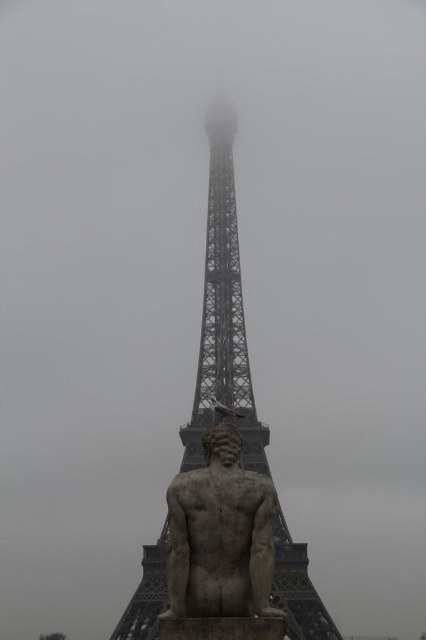
This screenshot has height=640, width=426. What do you see at coordinates (222, 314) in the screenshot?
I see `metallic gray eiffel tower at center` at bounding box center [222, 314].

Can you confirm if metallic gray eiffel tower at center is thinner than stone statue at lower center?

In fact, metallic gray eiffel tower at center might be wider than stone statue at lower center.

This screenshot has width=426, height=640. What are the coordinates of `metallic gray eiffel tower at center` in the screenshot? It's located at (222, 314).

Where is `metallic gray eiffel tower at center`? The image size is (426, 640). metallic gray eiffel tower at center is located at coordinates (222, 314).